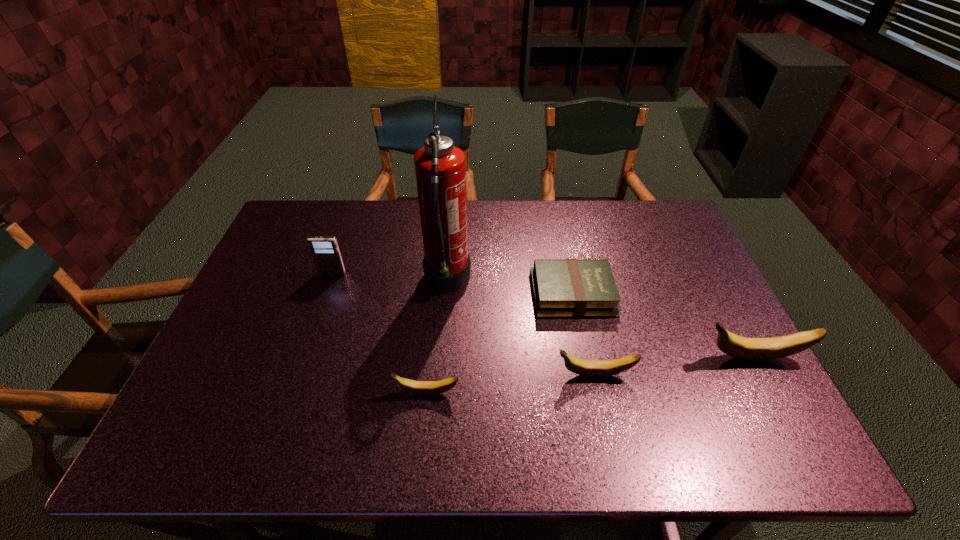
You are a GUI agent. You are given a task and a screenshot of the screen. Output one action in this format:
    pyautogui.click(x=<x>, y=<y>)
    Task: Click on the vacant space located on the left of the book
    This screenshot has width=960, height=540.
    Given the screenshot: What is the action you would take?
    [455, 294]

Where is `object positioned at the right edge`? Image resolution: width=960 pixels, height=540 pixels. object positioned at the right edge is located at coordinates (750, 349).

What are the coordinates of `free location at the far edge of the desktop` in the screenshot? It's located at (563, 225).

The height and width of the screenshot is (540, 960). In order to click on vacant point at the near edge in this screenshot , I will do `click(370, 406)`.

In the image, there is a desktop. Identify the location of vacant space at the left edge. This screenshot has width=960, height=540. (265, 279).

In the image, there is a desktop. At what (x,y) coordinates should I click in order to perform the action: click on free space at the right edge. Please return your answer as a coordinate pair (x, y). Looking at the image, I should click on (680, 265).

Identify the location of vacant space at the far left corner of the desktop. This screenshot has width=960, height=540. (319, 234).

Find the location of `vacant point at the far right corner`. vacant point at the far right corner is located at coordinates (659, 225).

At what (x,y) coordinates should I click in order to perform the action: click on free space at the near right corner. Please return your answer as a coordinate pair (x, y). Looking at the image, I should click on (746, 379).

I want to click on blank region between the second nearest object and the iPod, so click(464, 323).